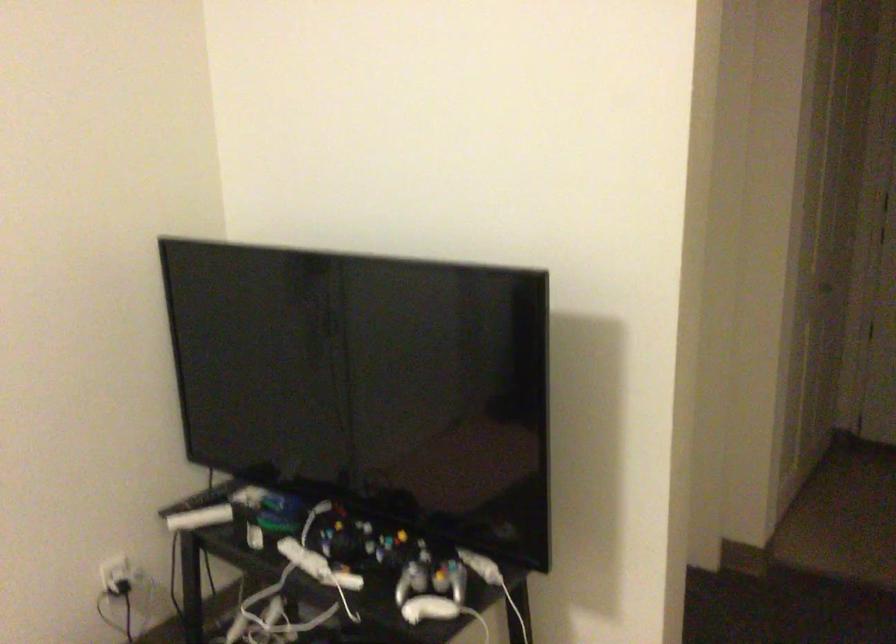
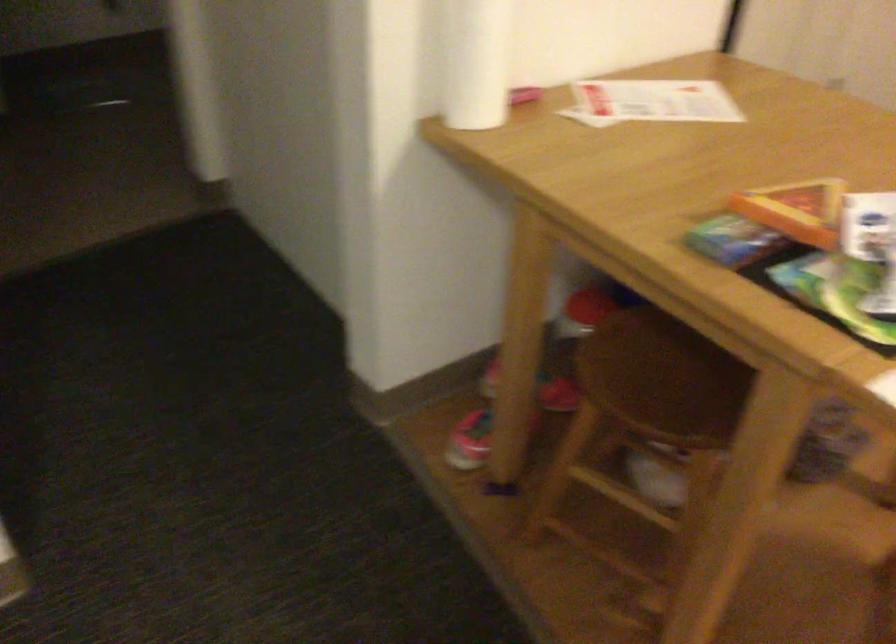
Based on the continuous images, in which direction is the camera rotating?

The camera rotated toward right-down.